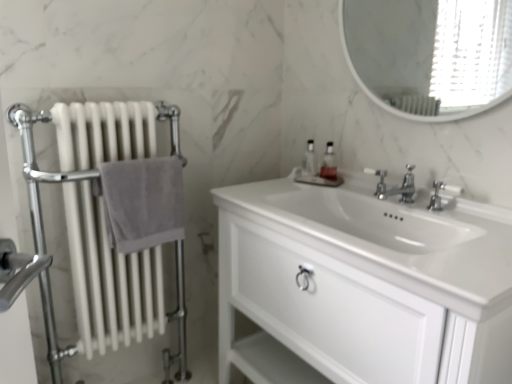
You are a GUI agent. You are given a task and a screenshot of the screen. Output one action in this format:
    pyautogui.click(x=<x>, y=<y>)
    Task: Click on the free spot in front of polished chrome faucet at center, the 1th tap viewed from the right
    The height and width of the screenshot is (384, 512).
    Given the screenshot: What is the action you would take?
    pyautogui.click(x=465, y=228)